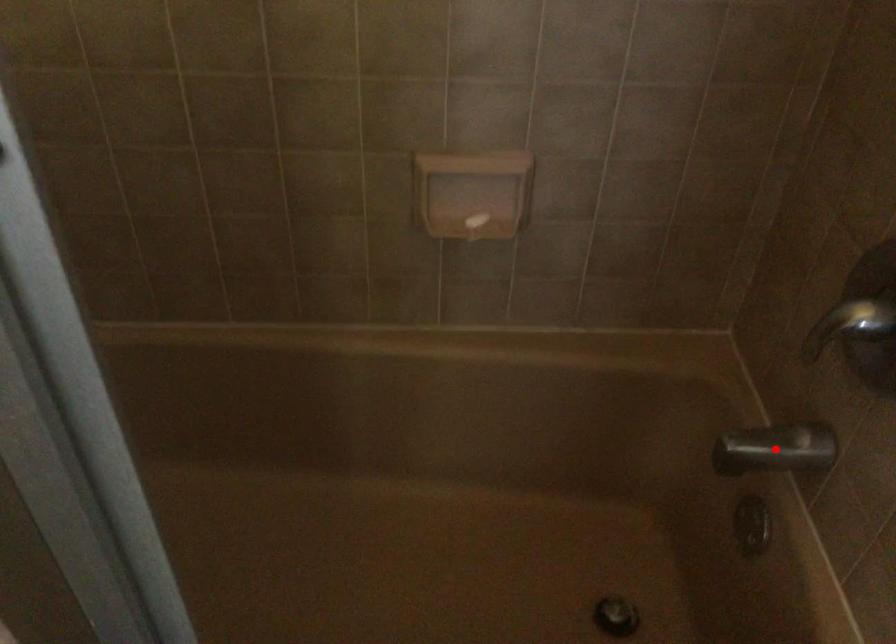
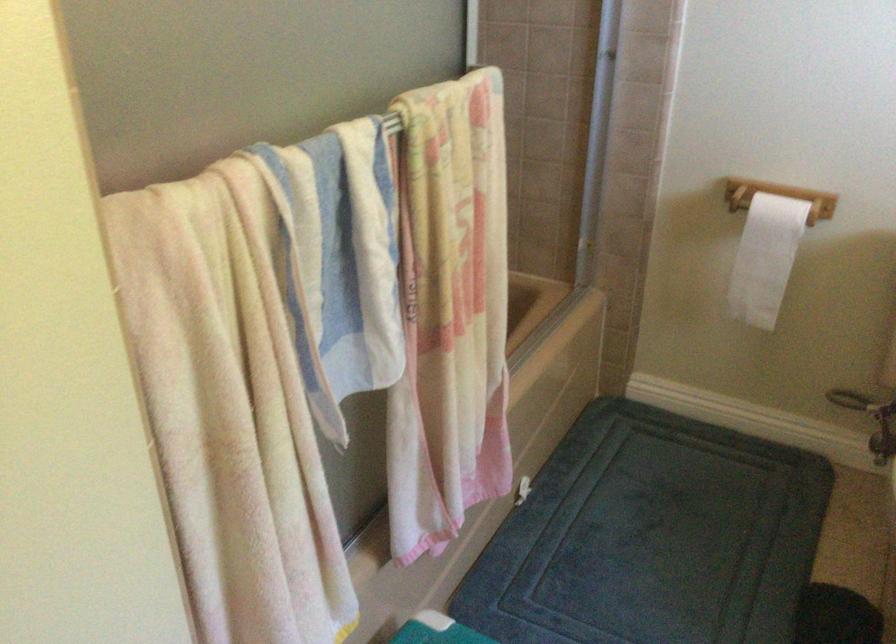
Question: I am providing you with two images of the same scene from different viewpoints. A red point is marked on the first image. Is the red point's position out of view in image 2?

Choices:
 (A) Yes
 (B) No

Answer: (A)